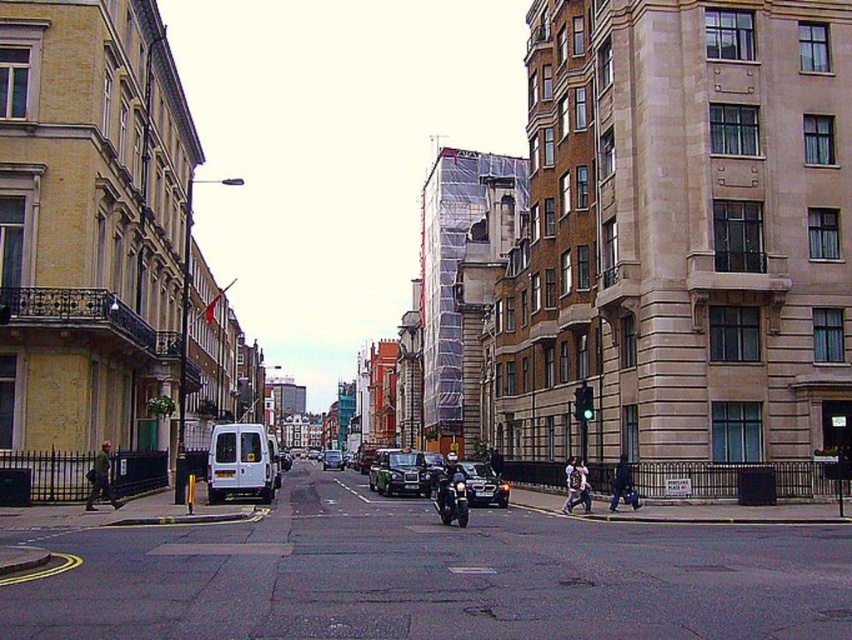
Question: Can you confirm if metallic silver car at center is wider than dark blue jeans at lower right?

Choices:
 (A) no
 (B) yes

Answer: (B)

Question: Does dark gray jacket at left have a smaller size compared to matte black car at center?

Choices:
 (A) yes
 (B) no

Answer: (A)

Question: Is black metallic car at center closer to the viewer compared to shiny chrome motorcycle at center?

Choices:
 (A) no
 (B) yes

Answer: (A)

Question: Which point is farther from the camera taking this photo?

Choices:
 (A) (111, 490)
 (B) (327, 461)

Answer: (B)

Question: Estimate the real-world distances between objects in this image. Which object is closer to the matte black car at center?

Choices:
 (A) dark blue jeans at lower right
 (B) metallic silver car at center
 (C) dark gray jacket at left

Answer: (B)

Question: Among these points, which one is farthest from the camera?

Choices:
 (A) (568, 486)
 (B) (337, 449)

Answer: (B)